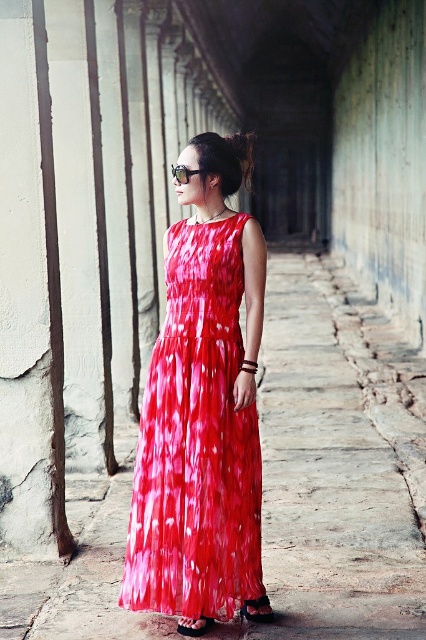
Does shiny silk dress at center have a lesser height compared to matte black sandal at lower center?

No, shiny silk dress at center is not shorter than matte black sandal at lower center.

Based on the photo, who is more distant from viewer, [245,483] or [270,611]?

The point [270,611] is behind.

I want to click on shiny silk dress at center, so click(x=196, y=442).

Does matte black sandal at lower center have a smaller size compared to black leather sandal at center?

No.

Between matte black sandal at lower center and black leather sandal at center, which one is positioned lower?

black leather sandal at center is below.

In order to click on matte black sandal at lower center in this screenshot , I will do `click(258, 611)`.

Find the location of a particular element. This screenshot has width=426, height=640. matte black sandal at lower center is located at coordinates (258, 611).

Which is in front, point (124, 477) or point (267, 614)?

Point (267, 614)

Between point (129, 458) and point (253, 600), which one is positioned in front?

Point (253, 600) is in front.

Image resolution: width=426 pixels, height=640 pixels. I want to click on smooth stone pavement at center, so click(337, 464).